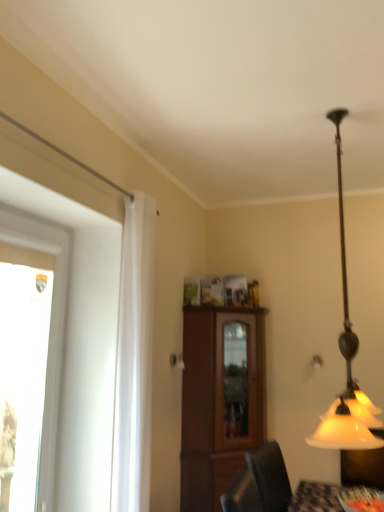
Locate an element on the screen. This screenshot has width=384, height=512. transparent glass window at left is located at coordinates click(x=50, y=325).

What do you see at coordinates (50, 325) in the screenshot?
I see `transparent glass window at left` at bounding box center [50, 325].

What do you see at coordinates (346, 360) in the screenshot? The width and height of the screenshot is (384, 512). I see `matte glass lampshade at right` at bounding box center [346, 360].

Where is `transparent glass window at left`? The height and width of the screenshot is (512, 384). transparent glass window at left is located at coordinates (50, 325).

Is point (339, 208) closer to viewer compared to point (55, 288)?

That is False.

Does matte glass lampshade at right turn towards transparent glass window at left?

No, matte glass lampshade at right is not facing towards transparent glass window at left.

Considering the relative sizes of matte glass lampshade at right and transparent glass window at left in the image provided, is matte glass lampshade at right wider than transparent glass window at left?

Yes, matte glass lampshade at right is wider than transparent glass window at left.

Looking at the image, does matte glass lampshade at right seem bigger or smaller compared to transparent glass window at left?

Considering their sizes, matte glass lampshade at right takes up more space than transparent glass window at left.

Considering the sizes of brown wood cabinet at center and matte glass lampshade at right in the image, is brown wood cabinet at center taller or shorter than matte glass lampshade at right?

Considering their sizes, brown wood cabinet at center has less height than matte glass lampshade at right.

Which of these two, brown wood cabinet at center or matte glass lampshade at right, is thinner?

matte glass lampshade at right is thinner.

The image size is (384, 512). Find the location of `lamp above the brown wood cabinet at center (from a real-world perspective)`. lamp above the brown wood cabinet at center (from a real-world perspective) is located at coordinates (346, 360).

In the scene shown: Which object is closer to the camera, brown wood cabinet at center or matte glass lampshade at right?

matte glass lampshade at right is closer to the camera.

From the image's perspective, relative to matte glass lampshade at right, is white sheer curtain at left above or below?

white sheer curtain at left is below matte glass lampshade at right.

How many degrees apart are the facing directions of white sheer curtain at left and matte glass lampshade at right?

4.46 degrees.

From a real-world perspective, is white sheer curtain at left physically located above or below matte glass lampshade at right?

white sheer curtain at left is below matte glass lampshade at right.

Locate an element on the screen. The height and width of the screenshot is (512, 384). curtain behind the matte glass lampshade at right is located at coordinates (134, 359).

From the image's perspective, which is below, matte glass lampshade at right or white sheer curtain at left?

white sheer curtain at left is shown below in the image.

Considering their positions, is matte glass lampshade at right located in front of or behind white sheer curtain at left?

matte glass lampshade at right is positioned closer to the viewer than white sheer curtain at left.

Does matte glass lampshade at right have a greater height compared to white sheer curtain at left?

Incorrect, the height of matte glass lampshade at right is not larger of that of white sheer curtain at left.

Is matte glass lampshade at right positioned before brown wood cabinet at center?

Yes, the depth of matte glass lampshade at right is less than that of brown wood cabinet at center.

Does point (337, 424) come behind point (234, 311)?

No, (337, 424) is closer to viewer.

This screenshot has height=512, width=384. Identify the location of cabinetry below the matte glass lampshade at right (from the image's perspective). (220, 399).

Which of these two, matte glass lampshade at right or brown wood cabinet at center, stands shorter?

With less height is brown wood cabinet at center.

Based on the photo, looking at their sizes, would you say transparent glass window at left is wider or thinner than white sheer curtain at left?

Considering their sizes, transparent glass window at left looks slimmer than white sheer curtain at left.

From the image's perspective, who appears lower, transparent glass window at left or white sheer curtain at left?

transparent glass window at left is shown below in the image.

Is transparent glass window at left placed right next to white sheer curtain at left?

They are not placed beside each other.

Is transparent glass window at left inside or outside of white sheer curtain at left?

transparent glass window at left cannot be found inside white sheer curtain at left.

From the image's perspective, which is below, brown wood cabinet at center or white sheer curtain at left?

From the image's view, brown wood cabinet at center is below.

Which object is positioned more to the left, brown wood cabinet at center or white sheer curtain at left?

white sheer curtain at left.

Are brown wood cabinet at center and white sheer curtain at left making contact?

No, brown wood cabinet at center is not making contact with white sheer curtain at left.

From a real-world perspective, is brown wood cabinet at center beneath white sheer curtain at left?

Yes, from a real-world perspective, brown wood cabinet at center is beneath white sheer curtain at left.

Locate an element on the screen. This screenshot has height=512, width=384. window to the left of matte glass lampshade at right is located at coordinates (50, 325).

This screenshot has width=384, height=512. What are the coordinates of `cabinetry that is below the matte glass lampshade at right (from the image's perspective)` in the screenshot? It's located at (220, 399).

When comparing their distances from matte glass lampshade at right, does transparent glass window at left or brown wood cabinet at center seem further?

transparent glass window at left lies further to matte glass lampshade at right than the other object.

When comparing their distances from matte glass lampshade at right, does transparent glass window at left or white sheer curtain at left seem closer?

white sheer curtain at left is closer to matte glass lampshade at right.

In the scene shown: Looking at the image, which one is located closer to transparent glass window at left, white sheer curtain at left or matte glass lampshade at right?

white sheer curtain at left is closer to transparent glass window at left.

Considering their positions, is transparent glass window at left positioned further to white sheer curtain at left than matte glass lampshade at right?

matte glass lampshade at right is positioned further to the anchor white sheer curtain at left.

From the image, which object appears to be farther from white sheer curtain at left, transparent glass window at left or brown wood cabinet at center?

The object further to white sheer curtain at left is brown wood cabinet at center.

From the image, which object appears to be farther from white sheer curtain at left, brown wood cabinet at center or transparent glass window at left?

Based on the image, brown wood cabinet at center appears to be further to white sheer curtain at left.

Considering their positions, is brown wood cabinet at center positioned further to transparent glass window at left than matte glass lampshade at right?

matte glass lampshade at right lies further to transparent glass window at left than the other object.

Looking at this image, when comparing their distances from matte glass lampshade at right, does brown wood cabinet at center or white sheer curtain at left seem further?

brown wood cabinet at center is positioned further to the anchor matte glass lampshade at right.

The image size is (384, 512). In order to click on curtain located between transparent glass window at left and matte glass lampshade at right in the left-right direction in this screenshot , I will do `click(134, 359)`.

Where is `curtain between transparent glass window at left and brown wood cabinet at center from left to right`? curtain between transparent glass window at left and brown wood cabinet at center from left to right is located at coordinates (134, 359).

What are the coordinates of `cabinetry located between transparent glass window at left and matte glass lampshade at right in the left-right direction` in the screenshot? It's located at (220, 399).

At what (x,y) coordinates should I click in order to perform the action: click on curtain between matte glass lampshade at right and brown wood cabinet at center in the front-back direction. Please return your answer as a coordinate pair (x, y). This screenshot has height=512, width=384. Looking at the image, I should click on (134, 359).